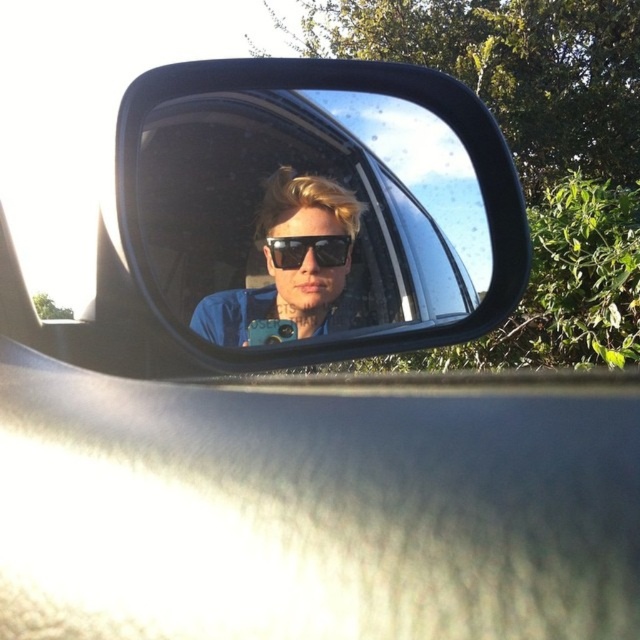
You are trying to take a photo with the camera while wearing the sunglasses at center. Can you keep both items in your hands at the same time?

The sunglasses at center and camera are 25.17 inches apart, so yes, you can hold both items in your hands simultaneously since the distance between them is manageable for typical hand movement.

You are trying to determine if the black plastic mirror at center can fit into a storage compartment that currently holds the black plastic sunglasses at center. Based on their sizes, can the mirror fit?

The black plastic mirror at center is larger in size than the black plastic sunglasses at center, so it may not fit into the storage compartment unless there is enough space to accommodate its larger size.